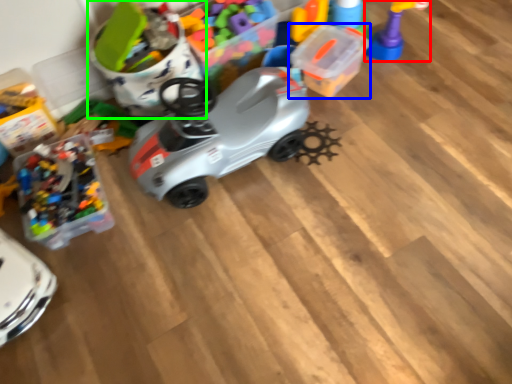
Question: Considering the real-world distances, which object is farthest from toy (highlighted by a red box)? toy (highlighted by a blue box) or toy (highlighted by a green box)?

Choices:
 (A) toy
 (B) toy

Answer: (B)